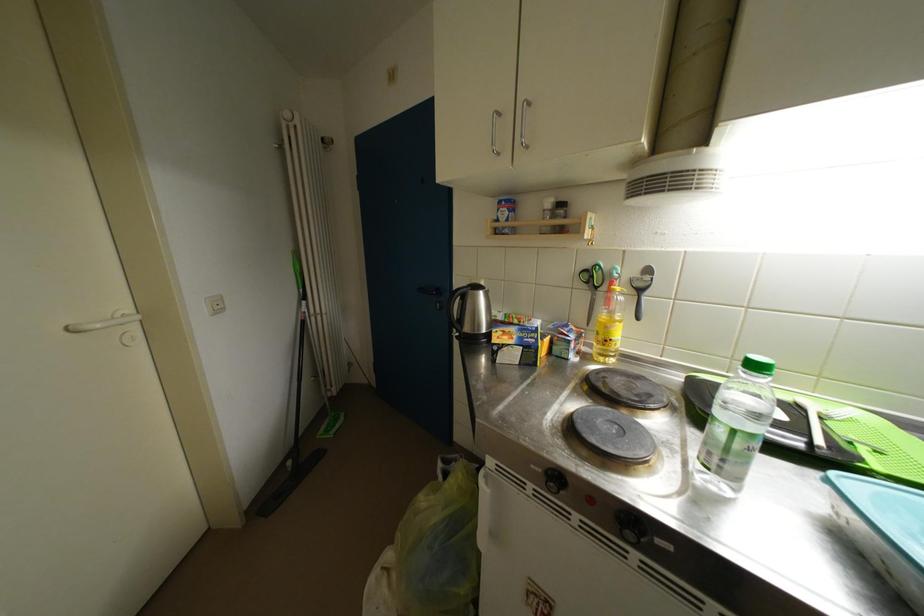
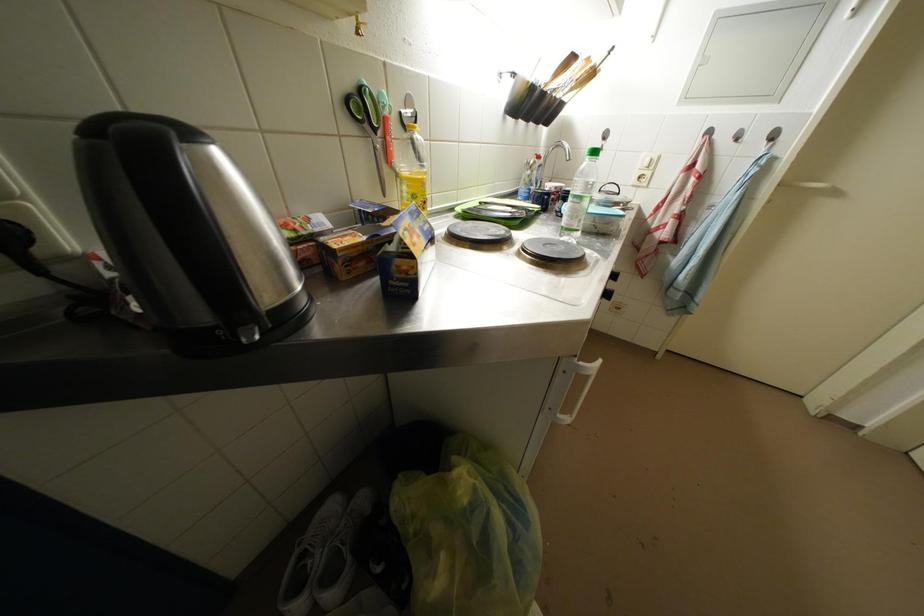
The first image is from the beginning of the video and the second image is from the end. How did the camera likely rotate when shooting the video?

The rotation direction of the camera is right-down.